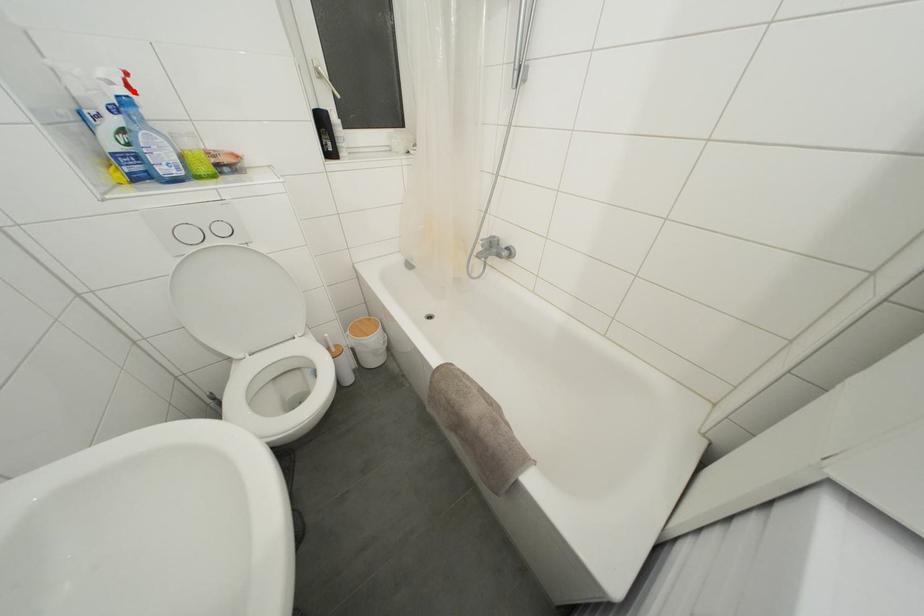
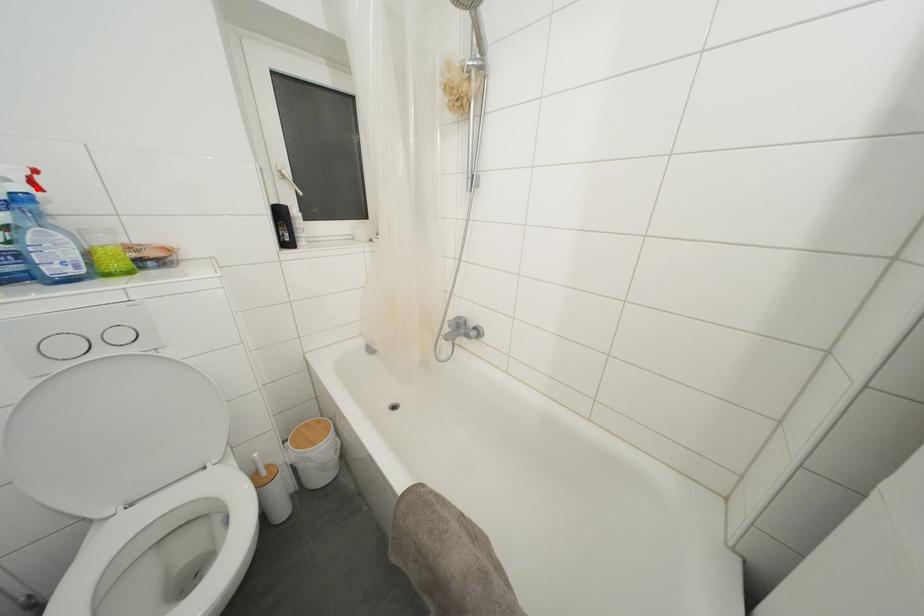
I am providing you with two images of the same scene from different viewpoints. A red point is marked on the first image and another point is marked on the second image. Do the highlighted points in image1 and image2 indicate the same real-world spot?

Yes